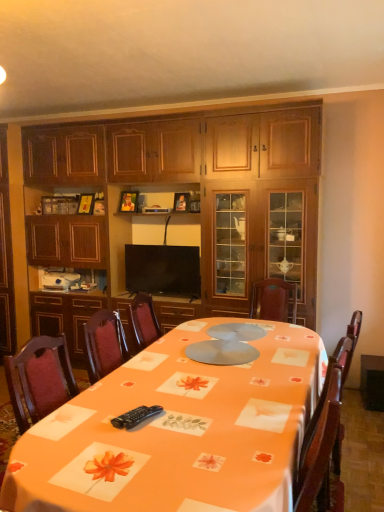
Question: Is black plastic remote control at lower center to the right of flat screen tv at center from the viewer's perspective?

Choices:
 (A) no
 (B) yes

Answer: (B)

Question: Does black plastic remote control at lower center turn towards flat screen tv at center?

Choices:
 (A) yes
 (B) no

Answer: (B)

Question: From the image's perspective, is black plastic remote control at lower center below flat screen tv at center?

Choices:
 (A) no
 (B) yes

Answer: (B)

Question: Is black plastic remote control at lower center further to the viewer compared to flat screen tv at center?

Choices:
 (A) no
 (B) yes

Answer: (A)

Question: Are black plastic remote control at lower center and flat screen tv at center far apart?

Choices:
 (A) yes
 (B) no

Answer: (A)

Question: Would you say black plastic remote control at lower center is inside or outside flat screen tv at center?

Choices:
 (A) inside
 (B) outside

Answer: (B)

Question: From the image's perspective, is black plastic remote control at lower center above or below flat screen tv at center?

Choices:
 (A) below
 (B) above

Answer: (A)

Question: Is point (145, 411) closer or farther from the camera than point (200, 288)?

Choices:
 (A) closer
 (B) farther

Answer: (A)

Question: Is black plastic remote control at lower center wider or thinner than flat screen tv at center?

Choices:
 (A) wide
 (B) thin

Answer: (A)

Question: Do you think black plastic remote control at lower center is within orange fabric table at center, or outside of it?

Choices:
 (A) inside
 (B) outside

Answer: (A)

Question: In terms of width, does black plastic remote control at lower center look wider or thinner when compared to orange fabric table at center?

Choices:
 (A) thin
 (B) wide

Answer: (A)

Question: From the image's perspective, is black plastic remote control at lower center positioned above or below orange fabric table at center?

Choices:
 (A) above
 (B) below

Answer: (A)

Question: Does point (137, 407) appear closer or farther from the camera than point (41, 467)?

Choices:
 (A) farther
 (B) closer

Answer: (A)

Question: Would you say wooden cabinet at center is to the left or to the right of orange fabric table at center in the picture?

Choices:
 (A) right
 (B) left

Answer: (B)

Question: In the image, is wooden cabinet at center positioned in front of or behind orange fabric table at center?

Choices:
 (A) front
 (B) behind

Answer: (B)